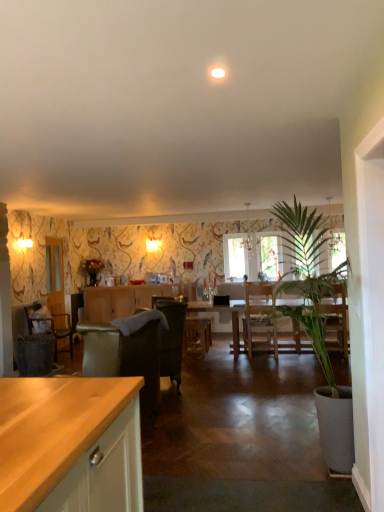
Question: Is wooden chair at left, the first chair from the back, situated inside velvet dark brown armchair at center, placed as the 1th chair when sorted from front to back, or outside?

Choices:
 (A) inside
 (B) outside

Answer: (B)

Question: Considering their positions, is wooden chair at left, the second chair from the right, located in front of or behind velvet dark brown armchair at center, placed as the 2th chair when sorted from back to front?

Choices:
 (A) front
 (B) behind

Answer: (B)

Question: Estimate the real-world distances between objects in this image. Which object is closer to the velvet dark brown armchair at center?

Choices:
 (A) metallic chandelier at center
 (B) wooden cabinet at center
 (C) wooden dining table at center
 (D) clear glass window screen at center
 (E) clear glass door at left

Answer: (C)

Question: Estimate the real-world distances between objects in this image. Which object is closer to the metallic chandelier at center?

Choices:
 (A) velvet dark brown armchair at center, the 1th chair in the right-to-left sequence
 (B) clear glass door at left
 (C) wooden cabinet at center
 (D) green leafy plant at right
 (E) velvet dark brown armchair at center

Answer: (E)